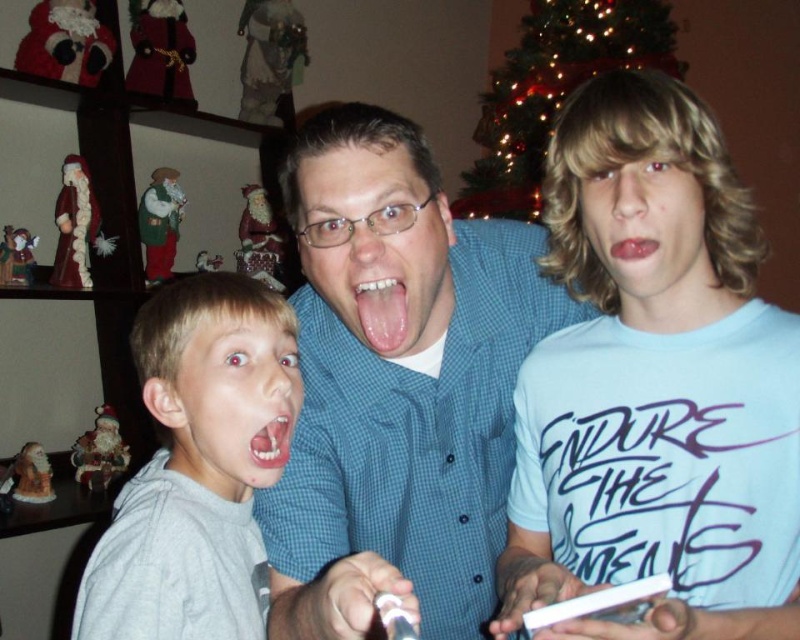
Which of these two, blue checkered shirt at center or gray matte hoodie at left, stands shorter?

Standing shorter between the two is gray matte hoodie at left.

Measure the distance between point (412, 240) and camera.

They are 31.39 inches apart.

Image resolution: width=800 pixels, height=640 pixels. I want to click on blue checkered shirt at center, so click(400, 378).

How far apart are light blue cotton shirt at right and shiny metallic ornament at upper center?

light blue cotton shirt at right and shiny metallic ornament at upper center are 1.78 meters apart.

Who is shorter, light blue cotton shirt at right or shiny metallic ornament at upper center?

With less height is light blue cotton shirt at right.

The width and height of the screenshot is (800, 640). Identify the location of light blue cotton shirt at right. (656, 384).

Locate an element on the screen. Image resolution: width=800 pixels, height=640 pixels. light blue cotton shirt at right is located at coordinates (656, 384).

Does light blue cotton shirt at right come behind white glossy teeth at center?

No, it is not.

Is point (778, 346) positioned before point (286, 451)?

Yes, it is in front of point (286, 451).

This screenshot has width=800, height=640. Describe the element at coordinates (656, 384) in the screenshot. I see `light blue cotton shirt at right` at that location.

Locate an element on the screen. light blue cotton shirt at right is located at coordinates (656, 384).